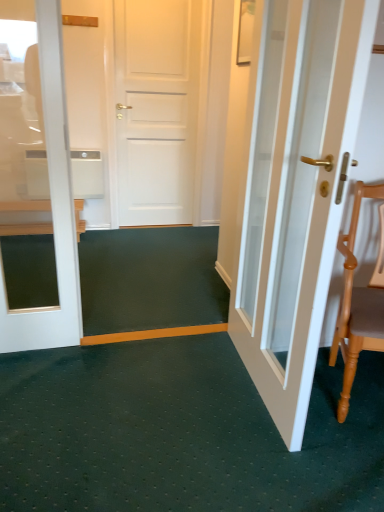
Question: Is wooden chair at left looking in the opposite direction of white glossy door at right?

Choices:
 (A) no
 (B) yes

Answer: (A)

Question: Is wooden chair at left aimed at white glossy door at right?

Choices:
 (A) yes
 (B) no

Answer: (B)

Question: Is wooden chair at left at the right side of white glossy door at right?

Choices:
 (A) yes
 (B) no

Answer: (B)

Question: From a real-world perspective, is wooden chair at left under white glossy door at right?

Choices:
 (A) yes
 (B) no

Answer: (A)

Question: Does wooden chair at left have a greater height compared to white glossy door at right?

Choices:
 (A) yes
 (B) no

Answer: (B)

Question: From the image's perspective, does wooden chair at left appear higher than white glossy door at right?

Choices:
 (A) yes
 (B) no

Answer: (A)

Question: Is white glossy door at right not near light brown wooden chair at right?

Choices:
 (A) yes
 (B) no

Answer: (B)

Question: From a real-world perspective, is white glossy door at right over light brown wooden chair at right?

Choices:
 (A) no
 (B) yes

Answer: (B)

Question: Is white glossy door at right behind light brown wooden chair at right?

Choices:
 (A) no
 (B) yes

Answer: (A)

Question: From the image's perspective, is white glossy door at right under light brown wooden chair at right?

Choices:
 (A) yes
 (B) no

Answer: (B)

Question: Is white glossy door at right oriented towards light brown wooden chair at right?

Choices:
 (A) yes
 (B) no

Answer: (A)

Question: Is white glossy door at right to the left of light brown wooden chair at right from the viewer's perspective?

Choices:
 (A) yes
 (B) no

Answer: (A)

Question: Considering the relative sizes of light brown wooden chair at right and wooden chair at left in the image provided, is light brown wooden chair at right taller than wooden chair at left?

Choices:
 (A) no
 (B) yes

Answer: (B)